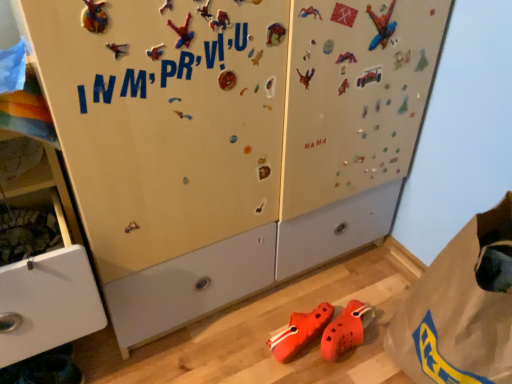
Question: From the image's perspective, is matte white cabinet at left located above or below brown paper bag at lower right?

Choices:
 (A) below
 (B) above

Answer: (B)

Question: Do you think matte white cabinet at left is within brown paper bag at lower right, or outside of it?

Choices:
 (A) outside
 (B) inside

Answer: (A)

Question: Estimate the real-world distances between objects in this image. Which object is farther from the brown paper bag at lower right?

Choices:
 (A) matte white cabinet at left
 (B) orange rubber clogs at lower center

Answer: (A)

Question: Which is nearer to the matte white cabinet at left?

Choices:
 (A) brown paper bag at lower right
 (B) orange rubber clogs at lower center

Answer: (B)